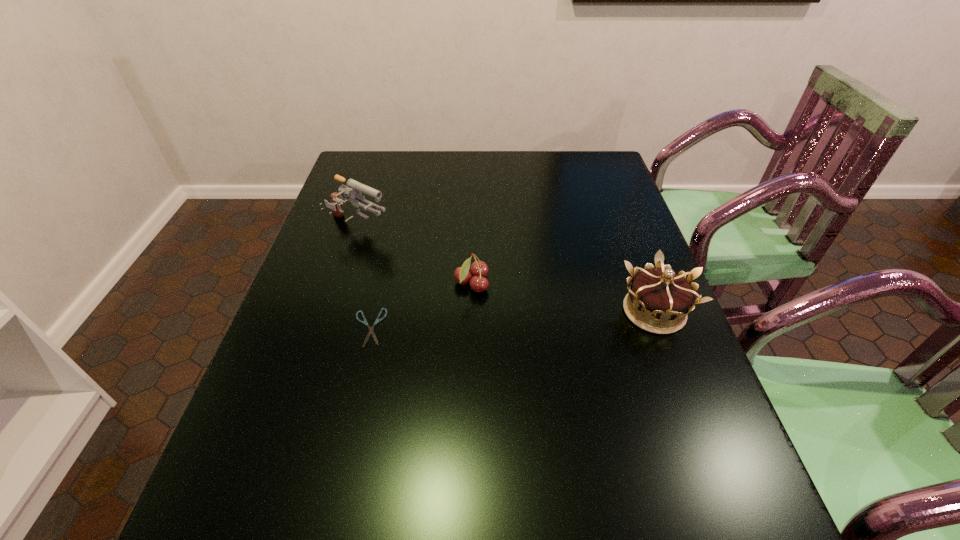
You are a GUI agent. You are given a task and a screenshot of the screen. Output one action in this format:
    pyautogui.click(x=<x>, y=<y>)
    Task: Click on the vacant space on the desktop that is between the shortest object and the rightmost object and is positioned on the leaves of the cherry
    
    Given the screenshot: What is the action you would take?
    pyautogui.click(x=552, y=317)

Locate an element on the screen. free space on the desktop that is between the shortest object and the rightmost object and is positioned at the barrel end of the gun is located at coordinates (544, 318).